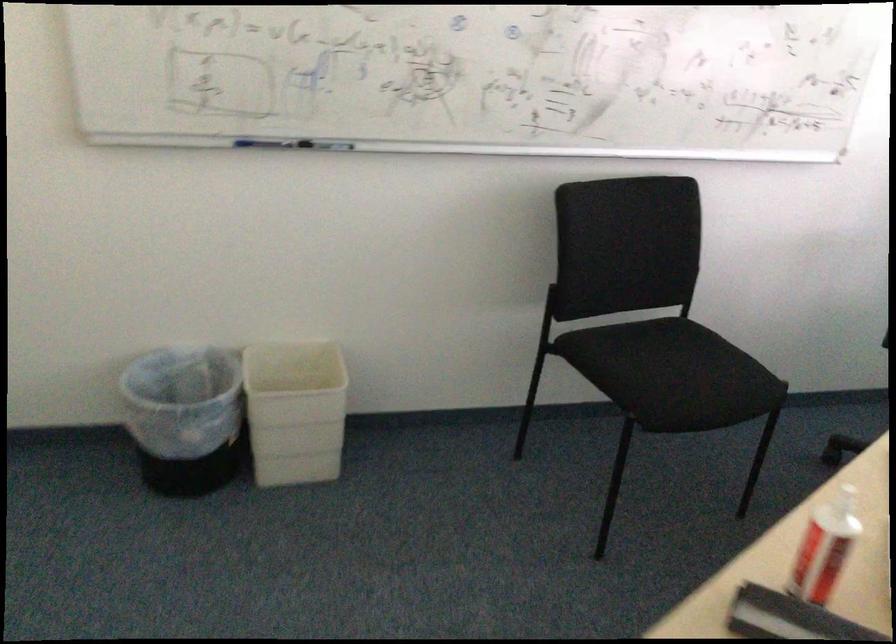
Where is `chair sitting surface`? The width and height of the screenshot is (896, 644). chair sitting surface is located at coordinates (688, 379).